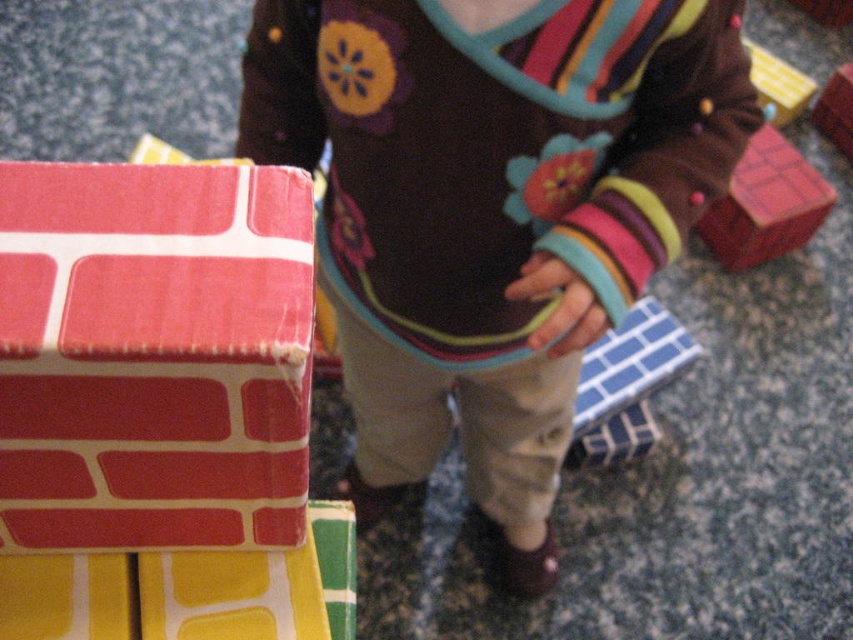
You are a toy organizer who needs to place the floral sweater at center and the matte red brick at right into storage boxes. The boxes are 3 feet wide. Can both items fit side by side in the same box without overlapping?

The floral sweater at center and the matte red brick at right are 3.30 feet apart, which means they are 3.30 feet apart from each other. Since the boxes are only 3 feet wide, the total width required for both items would exceed the box capacity. Therefore, they cannot fit side by side in the same box without overlapping.

You are a child trying to find a specific block in the image. The block you want is located at the point with coordinates (x=154, y=355). What is the surface or object that this point is on?

The point at coordinates (x=154, y=355) is on the brick patterned cardboard at left.

You are taking a photo of the child and the building blocks. You want to focus on the point at [354,88] and the point at [759,68]. Which point should you adjust your camera focus to first if you want to capture both points clearly in the photo?

You should focus on point [759,68] first because it is farther away from the camera than point [354,88]. This way, the closer point will also be in focus due to the depth of field.